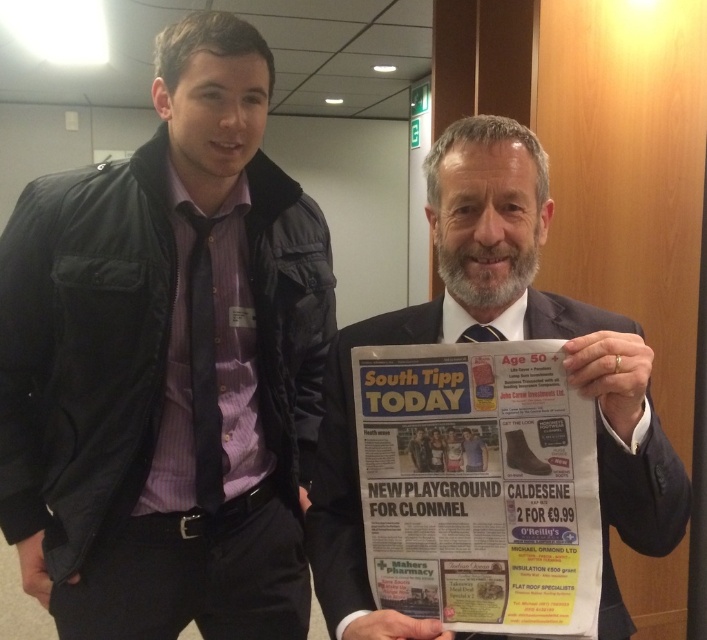
You are a photographer trying to capture a clear shot of both the dark gray suit at center and the dark blue textured tie at left. Since you want both subjects in focus, you need to adjust your camera to ensure depth of field. Which object should you focus on to make sure both are sharp?

You should focus on the dark gray suit at center because it is closer to the viewer, and using a smaller aperture will help keep both it and the dark blue textured tie at left in focus.

In the scene shown: You are a photographer setting up for a group photo. You need to arrange the matte black jacket at left and the dark gray suit at center in a straight line from left to right. Based on their current positions, which object should be placed first from the left?

The matte black jacket at left should be placed first from the left since it is already positioned on the left side of the dark gray suit at center.